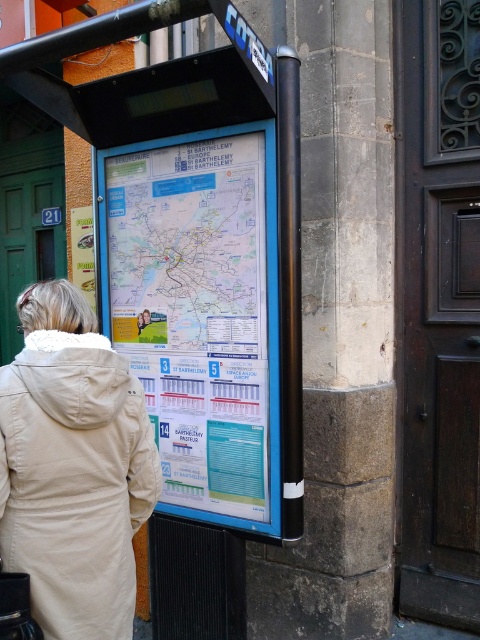
Who is lower down, white paper map at center or beige fleece coat at lower left?

beige fleece coat at lower left is below.

Which is in front, point (230, 451) or point (105, 356)?

Point (105, 356)

I want to click on white paper map at center, so click(197, 310).

Measure the distance between point [15,84] and camera.

The distance of point [15,84] from camera is 6.52 feet.

In the scene shown: Who is more forward, (66, 116) or (67, 308)?

Point (67, 308) is more forward.

Which is in front, point (294, 385) or point (112, 356)?

Point (112, 356)

The height and width of the screenshot is (640, 480). Identify the location of blue plastic signboard at center. (165, 312).

Does blue plastic signboard at center appear on the left side of white paper map at center?

Indeed, blue plastic signboard at center is positioned on the left side of white paper map at center.

Can you confirm if blue plastic signboard at center is wider than white paper map at center?

Indeed, blue plastic signboard at center has a greater width compared to white paper map at center.

The image size is (480, 640). What do you see at coordinates (165, 312) in the screenshot?
I see `blue plastic signboard at center` at bounding box center [165, 312].

Find the location of a particular element. Image resolution: width=480 pixels, height=640 pixels. blue plastic signboard at center is located at coordinates (165, 312).